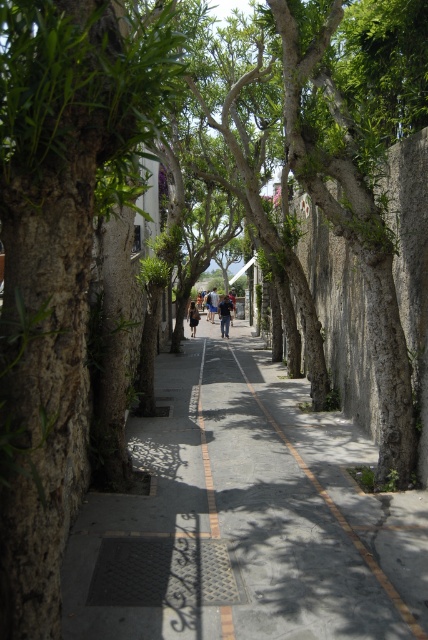
You are standing at the entrance of the pathway and see the dark blue denim jacket at center lying on the ground. If you walk straight ahead along the pathway, will the jacket come into your direct line of sight before you reach the stone walls on the right side?

The dark blue denim jacket at center is located at point (x=225, y=316), which is near the center of the pathway. Since the stone walls are on one side, walking straight ahead would keep the jacket in your direct line of sight as you move forward. However, the question specifies whether the jacket comes into your line of sight before reaching the stone walls. Without specific distance information between the jacket and the walls, it is impossible to determine this definitively. The jacket is centrally placed,

You are a delivery person carrying a package and need to place it on the ground. You see the smooth concrete pavement at center and the light brown leather jacket at center. Which surface is closer to you?

The light brown leather jacket at center is closer to you since it is only 0.9 feet away from the smooth concrete pavement at center, which is 99.10 feet away.

Based on the photo, you are a delivery person carrying a large box that is 1.8 meters long. You need to walk along the narrow pedestrian pathway shown in the image. The pathway has a smooth concrete pavement at center and a dark blue denim jacket at center. Can you pass through the pathway without the box hitting any obstacles?

The smooth concrete pavement at center and dark blue denim jacket at center are 17.99 meters apart. Since the distance between them is greater than the length of your box, you can pass through the pathway without the box hitting any obstacles.